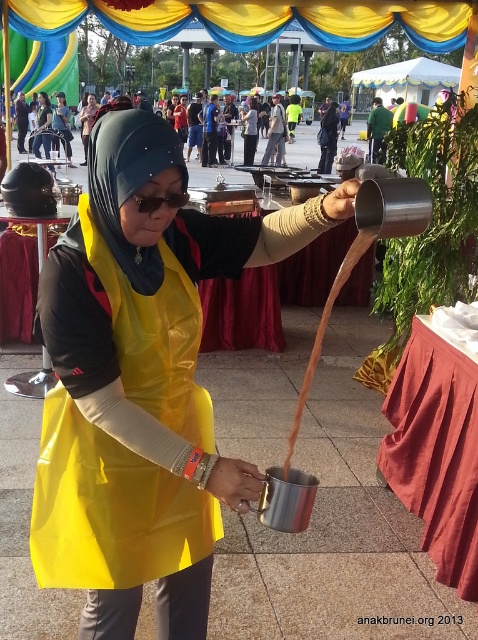
Can you confirm if metallic yellow apron at center is shorter than yellow matte apron at center?

Yes.

Which of these two, metallic yellow apron at center or yellow matte apron at center, stands shorter?

With less height is metallic yellow apron at center.

Is point (87, 522) farther from camera compared to point (68, 134)?

That is False.

The height and width of the screenshot is (640, 478). In order to click on metallic yellow apron at center in this screenshot , I will do `click(141, 381)`.

Does metallic yellow apron at center have a larger size compared to matte yellow apron at center?

Incorrect, metallic yellow apron at center is not larger than matte yellow apron at center.

Does point (85, 412) come closer to viewer compared to point (246, 157)?

Yes, it is in front of point (246, 157).

Does point (164, 234) lie behind point (243, 163)?

No, (164, 234) is closer to viewer.

Locate an element on the screen. The width and height of the screenshot is (478, 640). metallic yellow apron at center is located at coordinates (141, 381).

Is point (66, 148) closer to camera compared to point (245, 136)?

Yes, it is.

The width and height of the screenshot is (478, 640). What are the coordinates of `yellow matte apron at center` in the screenshot? It's located at (62, 125).

The width and height of the screenshot is (478, 640). Find the location of `yellow matte apron at center`. yellow matte apron at center is located at coordinates 62,125.